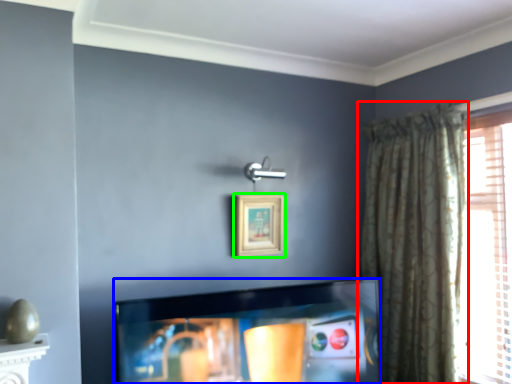
Question: Considering the real-world distances, which object is farthest from curtain (highlighted by a red box)? television (highlighted by a blue box) or picture frame (highlighted by a green box)?

Choices:
 (A) television
 (B) picture frame

Answer: (B)